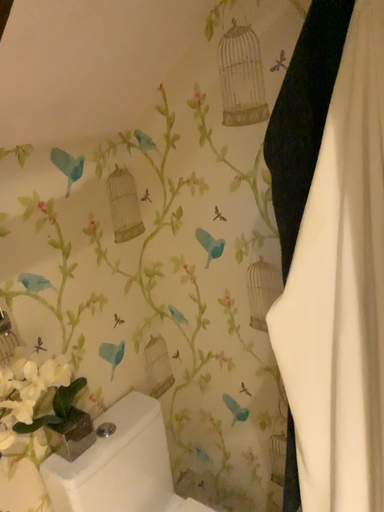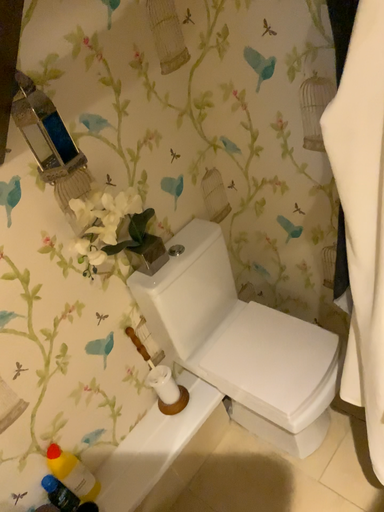
Question: How did the camera likely rotate when shooting the video?

Choices:
 (A) rotated upward
 (B) rotated downward

Answer: (B)